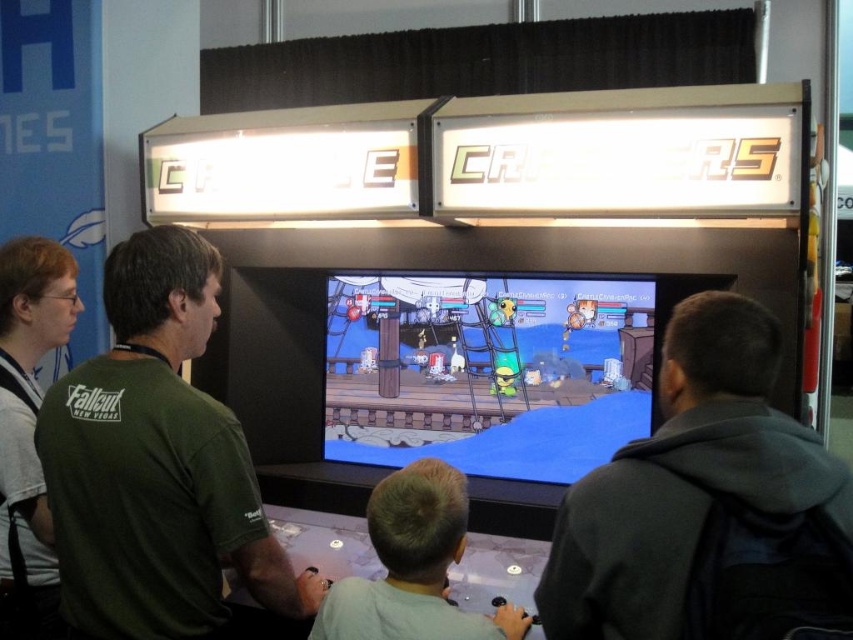
You are a photographer at the arcade and want to take a photo of the green matte shirt at left and the light brown hair at center. Which one should you focus on first to ensure they are both in sharp focus?

The green matte shirt at left is further to the viewer than the light brown hair at center, so you should focus on the green matte shirt at left first to ensure both are in sharp focus.

Consider the image. You are a game developer analyzing the layout of the arcade machine. You notice two points marked on the screen of the machine. The first point is at coordinates point (618, 470) and the second is at point (201, 589). Which point is positioned closer to the viewer?

Point (618, 470) is closer to the viewer than point (201, 589).